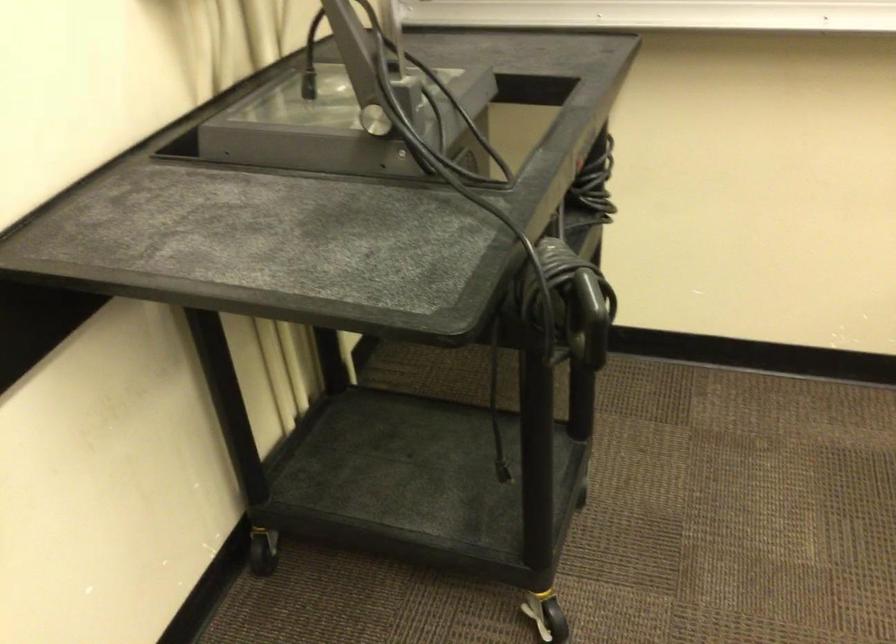
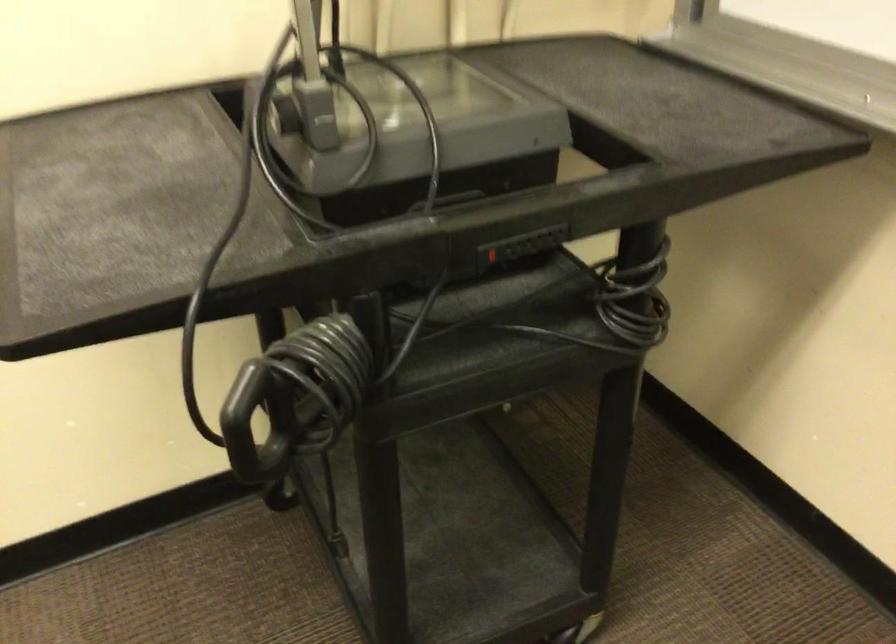
Question: The first image is from the beginning of the video and the second image is from the end. How did the camera likely rotate when shooting the video?

Choices:
 (A) Left
 (B) Right
 (C) Up
 (D) Down

Answer: (A)